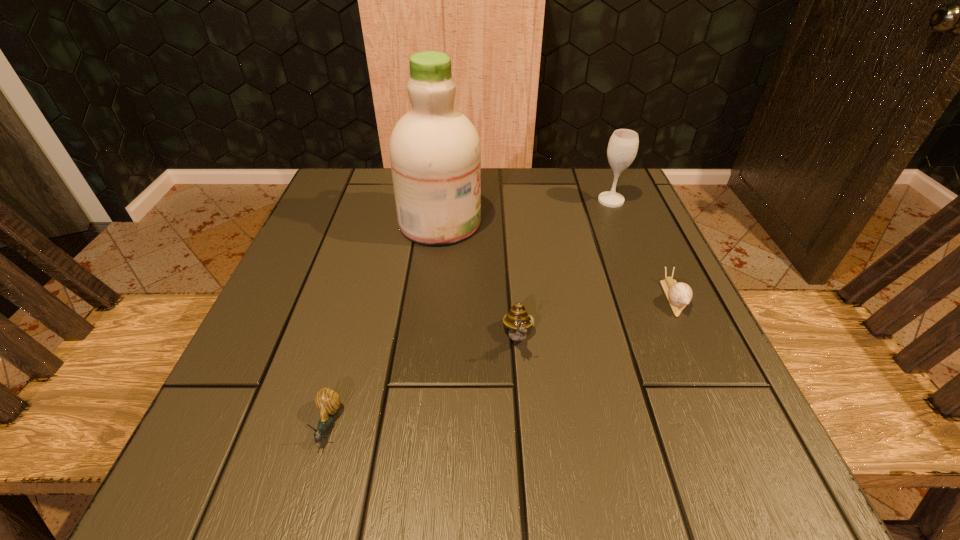
The width and height of the screenshot is (960, 540). What are the coordinates of `cleansing agent` in the screenshot? It's located at (x=435, y=152).

Where is `the fourth object from right to left`? The height and width of the screenshot is (540, 960). the fourth object from right to left is located at coordinates (435, 152).

Where is `the fourth shortest object`? the fourth shortest object is located at coordinates (623, 145).

Locate an element on the screen. This screenshot has height=540, width=960. the second escargot from left to right is located at coordinates (517, 320).

Where is `the tallest escargot`? the tallest escargot is located at coordinates (517, 320).

Identify the location of the nearest object. (327, 401).

You are a GUI agent. You are given a task and a screenshot of the screen. Output one action in this format:
    pyautogui.click(x=<x>, y=<y>)
    Task: Click on the leftmost object
    Image resolution: width=960 pixels, height=540 pixels.
    Given the screenshot: What is the action you would take?
    pyautogui.click(x=327, y=401)

This screenshot has height=540, width=960. Identify the location of the rightmost escargot. (679, 295).

You are a GUI agent. You are given a task and a screenshot of the screen. Output one action in this format:
    pyautogui.click(x=<x>, y=<y>)
    Task: Click on the blank space located 0.220m on the front label of the cleansing agent
    
    Given the screenshot: What is the action you would take?
    pyautogui.click(x=583, y=222)

Image resolution: width=960 pixels, height=540 pixels. I want to click on free space located 0.130m on the front of the wineglass, so click(x=628, y=243).